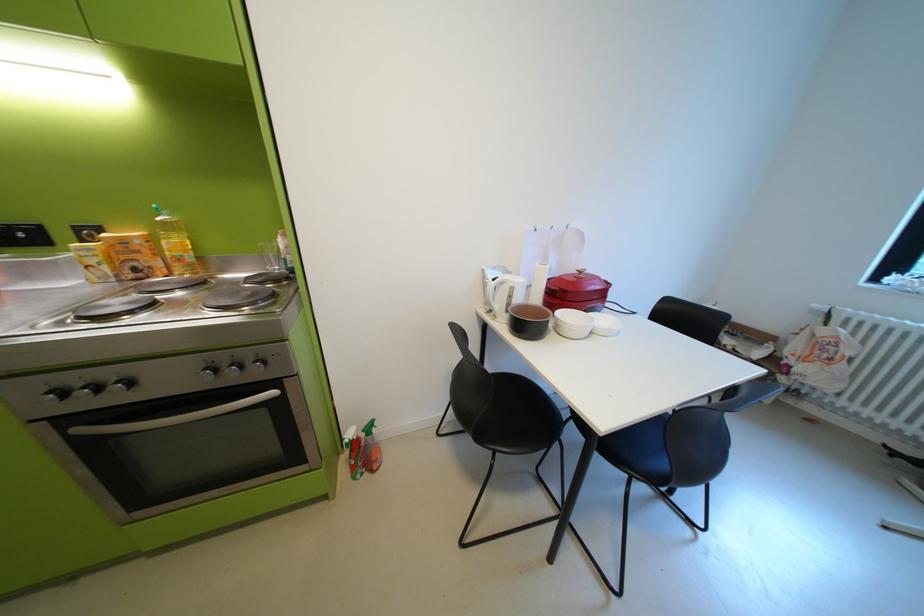
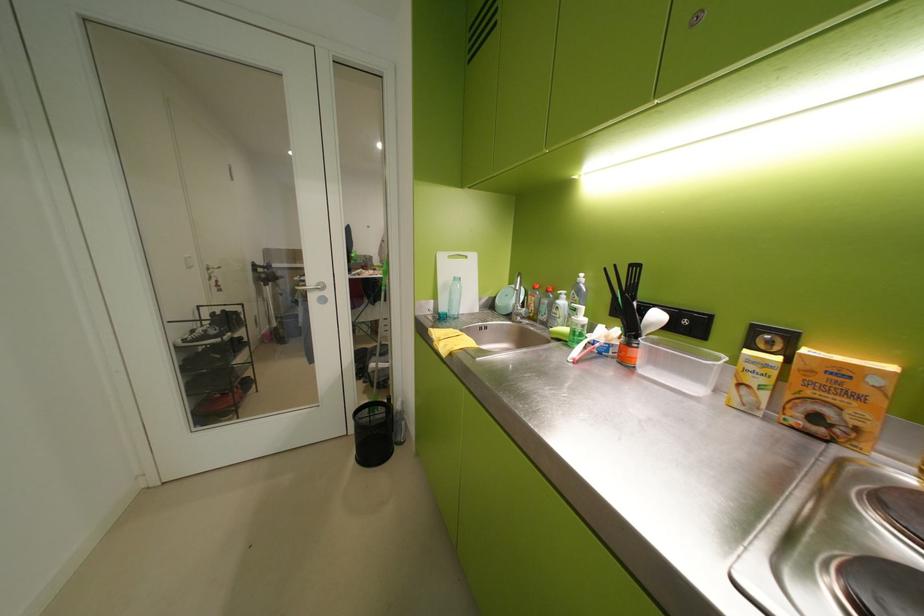
Where in the second image is the point corresponding to [134,243] from the first image?

(852, 373)